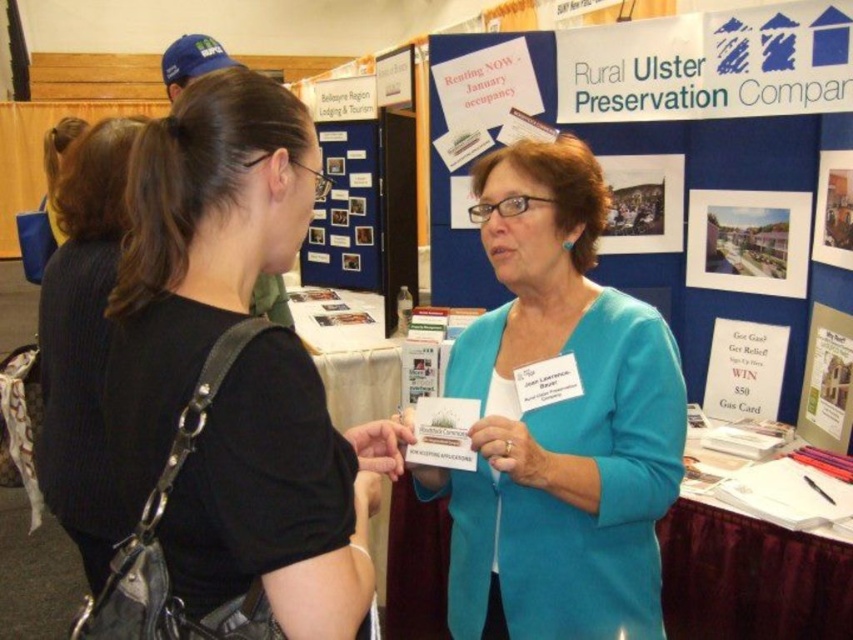
Does matte paper poster at upper right appear over white paper poster at upper center?

Incorrect, matte paper poster at upper right is not positioned above white paper poster at upper center.

How distant is matte paper poster at upper right from white paper poster at upper center?

4.41 feet

Identify the location of matte paper poster at upper right. (747, 241).

Can you confirm if black matte shirt at upper left is wider than matte paper poster at upper right?

Yes, black matte shirt at upper left is wider than matte paper poster at upper right.

Who is positioned more to the left, black matte shirt at upper left or matte paper poster at upper right?

From the viewer's perspective, black matte shirt at upper left appears more on the left side.

Locate an element on the screen. The image size is (853, 640). black matte shirt at upper left is located at coordinates (199, 248).

Does point (297, 488) come behind point (409, 74)?

No, (297, 488) is in front of (409, 74).

Does black matte shirt at upper left appear on the left side of white paper poster at upper center?

Correct, you'll find black matte shirt at upper left to the left of white paper poster at upper center.

Which is behind, point (193, 516) or point (408, 106)?

The point (408, 106) is behind.

Locate an element on the screen. black matte shirt at upper left is located at coordinates (199, 248).